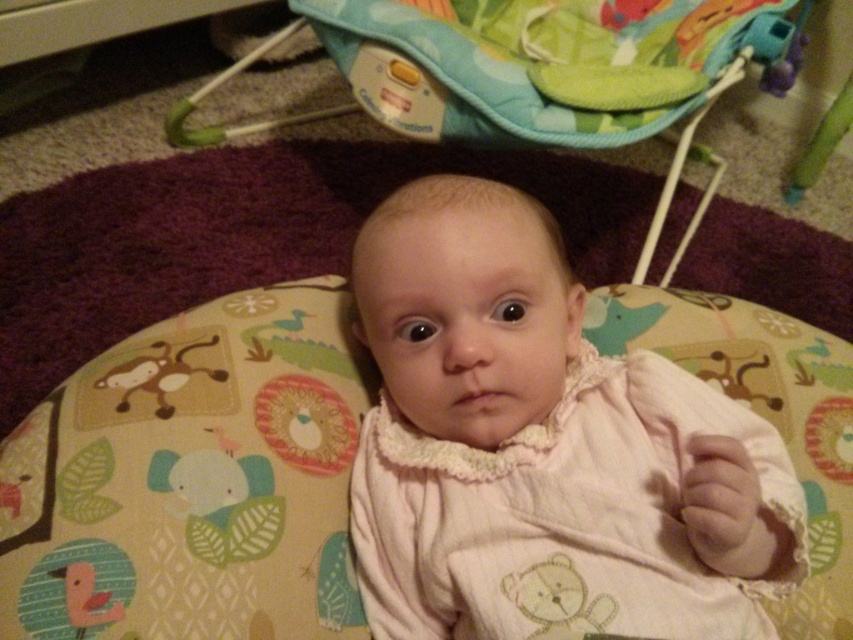
Is white textured fabric at center positioned before multicolored fabric baby carriage at center?

Yes, it is in front of multicolored fabric baby carriage at center.

Which is behind, point (606, 458) or point (785, 36)?

Positioned behind is point (785, 36).

The image size is (853, 640). What do you see at coordinates (543, 448) in the screenshot?
I see `white textured fabric at center` at bounding box center [543, 448].

You are a GUI agent. You are given a task and a screenshot of the screen. Output one action in this format:
    pyautogui.click(x=<x>, y=<y>)
    Task: Click on the white textured fabric at center
    
    Given the screenshot: What is the action you would take?
    pyautogui.click(x=543, y=448)

Can you confirm if white textured fabric at center is bigger than soft fabric baby bed at center?

No, white textured fabric at center is not bigger than soft fabric baby bed at center.

Between white textured fabric at center and soft fabric baby bed at center, which one appears on the right side from the viewer's perspective?

white textured fabric at center

Is point (654, 488) closer to viewer compared to point (276, 408)?

Yes, it is in front of point (276, 408).

In order to click on white textured fabric at center in this screenshot , I will do `click(543, 448)`.

Can you confirm if soft fabric baby bed at center is positioned to the right of multicolored fabric baby carriage at center?

In fact, soft fabric baby bed at center is to the left of multicolored fabric baby carriage at center.

The image size is (853, 640). What do you see at coordinates (192, 480) in the screenshot? I see `soft fabric baby bed at center` at bounding box center [192, 480].

This screenshot has height=640, width=853. I want to click on soft fabric baby bed at center, so click(192, 480).